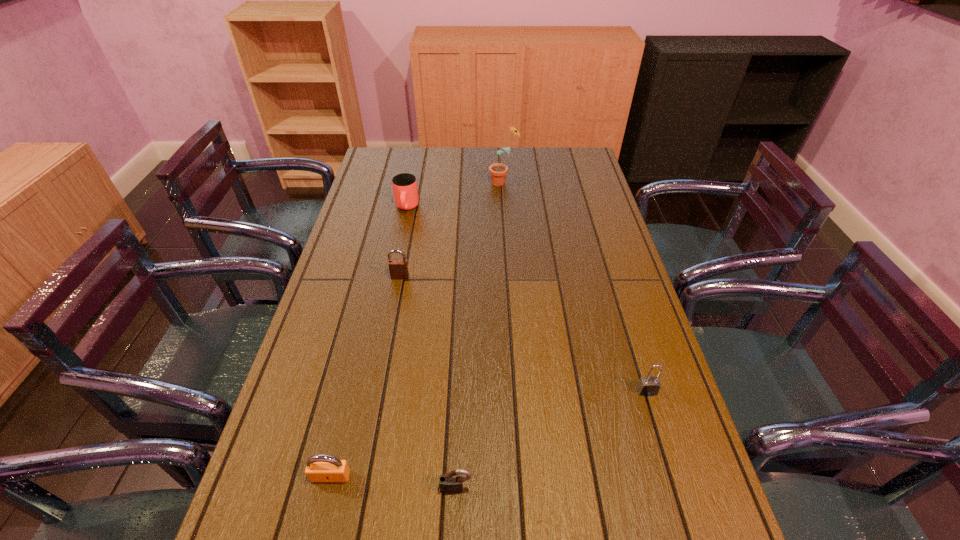
Find the location of a particular element. This screenshot has width=960, height=540. vacant position in the image that satisfies the following two spatial constraints: 1. on the flower of the farthest object; 2. on the front-facing side of the farthest padlock is located at coordinates (511, 277).

I want to click on vacant position in the image that satisfies the following two spatial constraints: 1. on the flower of the sunflower; 2. on the handle side of the cup, so click(506, 208).